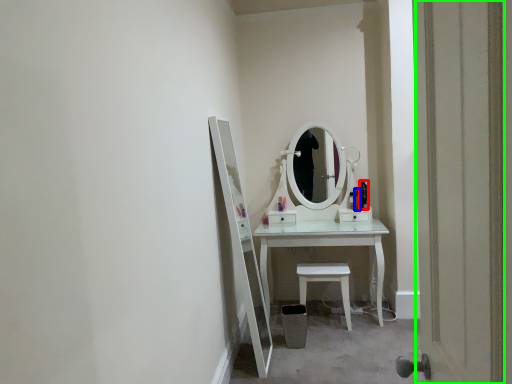
Question: Considering the real-world distances, which object is farthest from toiletry (highlighted by a red box)? toiletry (highlighted by a blue box) or door (highlighted by a green box)?

Choices:
 (A) toiletry
 (B) door

Answer: (B)